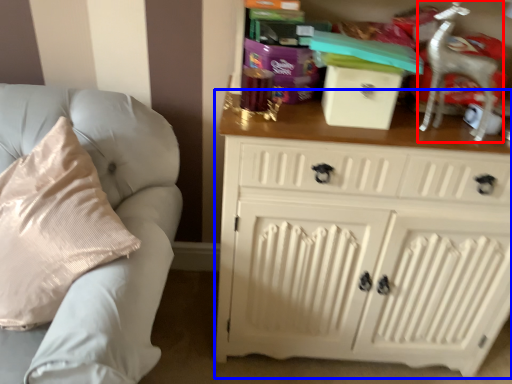
Question: Which object is closer to the camera taking this photo, rocking chair (highlighted by a red box) or chest of drawers (highlighted by a blue box)?

Choices:
 (A) rocking chair
 (B) chest of drawers

Answer: (B)